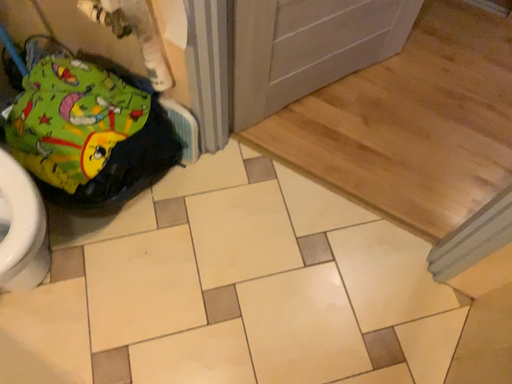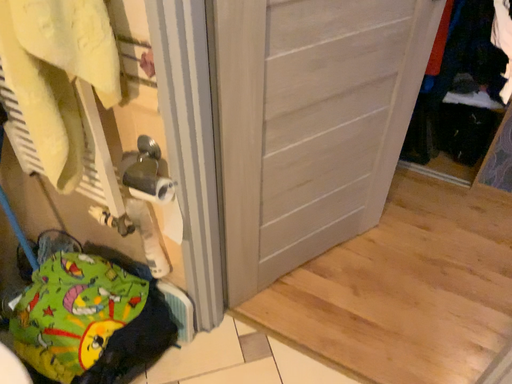
Question: Which way did the camera rotate in the video?

Choices:
 (A) rotated downward
 (B) rotated upward

Answer: (B)